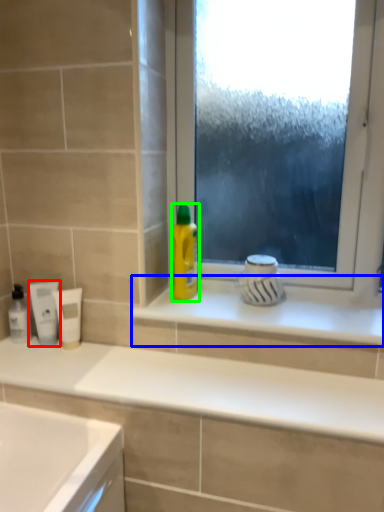
Question: Based on their relative distances, which object is farther from mouthwash (highlighted by a red box)? Choose from window sill (highlighted by a blue box) and cleaning product (highlighted by a green box).

Choices:
 (A) window sill
 (B) cleaning product

Answer: (A)